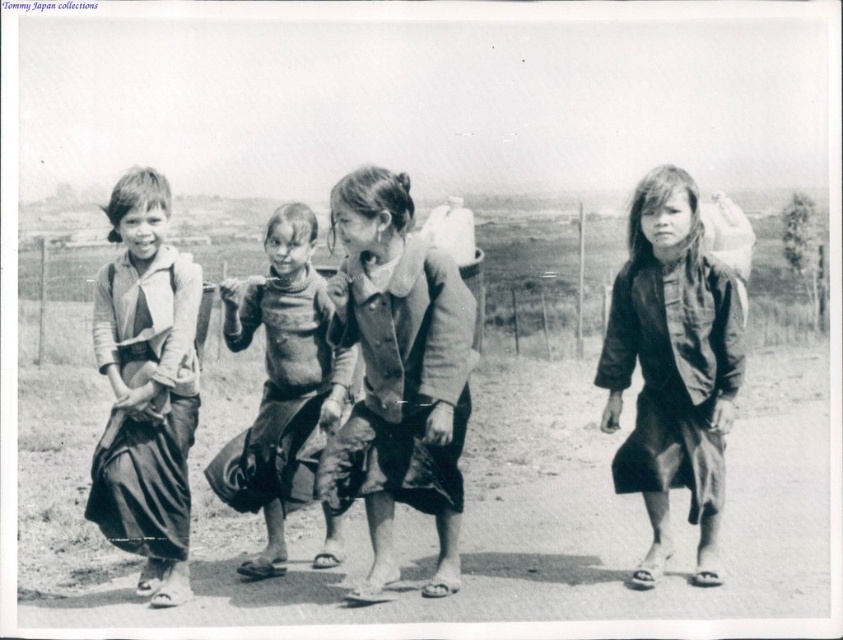
Question: Among these objects, which one is nearest to the camera?

Choices:
 (A) rough fabric shirt at center
 (B) dirt field at lower left
 (C) dark brown fabric dress at center
 (D) matte gray sweater at left

Answer: (B)

Question: Based on their relative distances, which object is farther from the rough fabric shirt at center?

Choices:
 (A) matte gray sweater at left
 (B) dark brown fabric dress at center
 (C) dirt field at lower left

Answer: (C)

Question: Which is nearer to the matte gray sweater at left?

Choices:
 (A) dark gray fabric dress at center
 (B) rough fabric shirt at center
 (C) dark brown fabric dress at center

Answer: (B)

Question: Can you confirm if dark gray fabric dress at center is thinner than matte gray sweater at left?

Choices:
 (A) yes
 (B) no

Answer: (B)

Question: Where is matte gray sweater at left located in relation to rough fabric shirt at center in the image?

Choices:
 (A) below
 (B) above

Answer: (B)

Question: Does matte gray sweater at left have a larger size compared to rough fabric shirt at center?

Choices:
 (A) no
 (B) yes

Answer: (A)